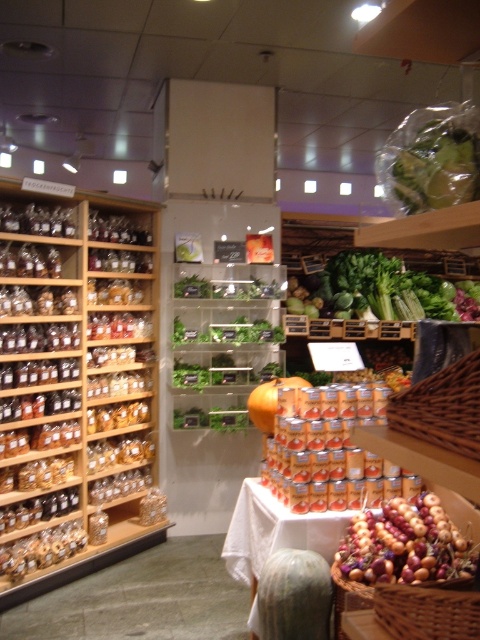
Question: Does translucent glass jars at left have a greater width compared to woven brown basket at lower right?

Choices:
 (A) yes
 (B) no

Answer: (A)

Question: Among these points, which one is farthest from the camera?

Choices:
 (A) (149, 330)
 (B) (354, 564)

Answer: (A)

Question: Among these objects, which one is farthest from the camera?

Choices:
 (A) woven brown basket at center-right
 (B) woven brown basket at lower right
 (C) green matte pumpkin at center
 (D) green leafy at center

Answer: (D)

Question: Which point is farther from the camera taking this photo?

Choices:
 (A) (351, 573)
 (B) (257, 586)
 (C) (23, 289)

Answer: (C)

Question: In this image, where is smooth brown onions at center located relative to woven brown basket at center-right?

Choices:
 (A) right
 (B) left

Answer: (A)

Question: Does green leafy at center have a greater width compared to woven brown basket at lower right?

Choices:
 (A) yes
 (B) no

Answer: (A)